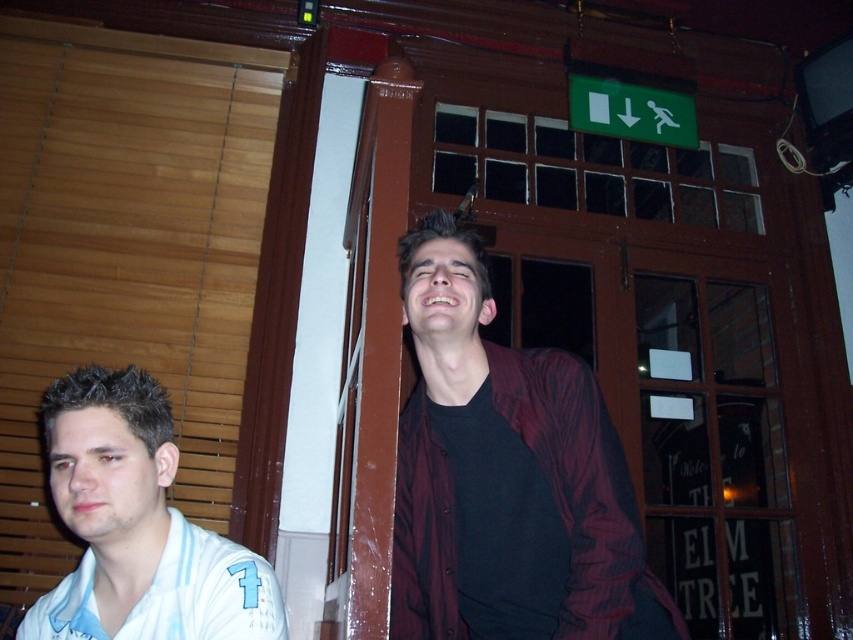
Which is more to the left, dark maroon jacket at center or white jersey at left?

white jersey at left is more to the left.

Between point (595, 381) and point (138, 609), which one is positioned in front?

Positioned in front is point (138, 609).

Is point (560, 444) in front of point (224, 595)?

No.

Where is `dark maroon jacket at center`? This screenshot has width=853, height=640. dark maroon jacket at center is located at coordinates (506, 477).

From the picture: Does white striped shirt at left have a lesser width compared to white jersey at left?

No, white striped shirt at left is not thinner than white jersey at left.

Which is below, white striped shirt at left or white jersey at left?

white jersey at left

Who is more forward, (91, 397) or (80, 605)?

Point (80, 605) is in front.

Where is `white striped shirt at left`? The width and height of the screenshot is (853, 640). white striped shirt at left is located at coordinates (137, 525).

Between point (607, 580) and point (258, 596), which one is positioned behind?

The point (258, 596) is more distant.

Who is taller, dark maroon jacket at center or white striped shirt at left?

With more height is dark maroon jacket at center.

Does point (483, 493) come closer to viewer compared to point (161, 612)?

That is False.

I want to click on dark maroon jacket at center, so click(506, 477).